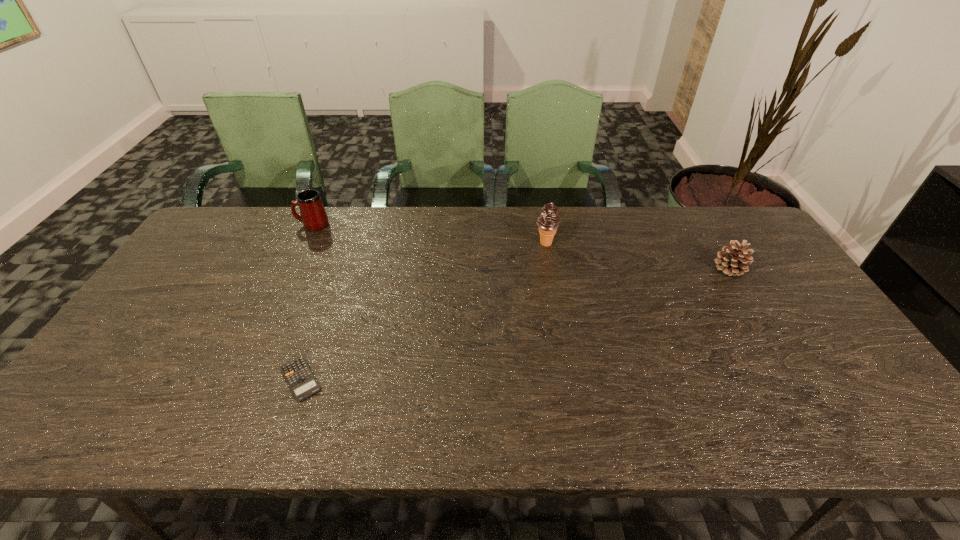
Image resolution: width=960 pixels, height=540 pixels. What are the coordinates of `icecream` in the screenshot? It's located at (548, 221).

Locate an element on the screen. Image resolution: width=960 pixels, height=540 pixels. the tallest object is located at coordinates (548, 221).

Find the location of a particular element. The height and width of the screenshot is (540, 960). mug is located at coordinates (313, 216).

At what (x,y) coordinates should I click in order to perform the action: click on the leftmost object. Please return your answer as a coordinate pair (x, y). Looking at the image, I should click on (313, 216).

I want to click on pinecone, so click(x=731, y=261).

Locate an element on the screen. This screenshot has width=960, height=540. the third farthest object is located at coordinates (731, 261).

Where is `calculator`? The image size is (960, 540). calculator is located at coordinates (303, 384).

Find the location of a particular element. Image resolution: width=960 pixels, height=540 pixels. the second object from left to right is located at coordinates [x=303, y=384].

Where is `vacant space located on the left of the second object from right to left`? vacant space located on the left of the second object from right to left is located at coordinates (515, 244).

Where is `vacant region located on the side of the farthest object with the handle`? vacant region located on the side of the farthest object with the handle is located at coordinates (258, 225).